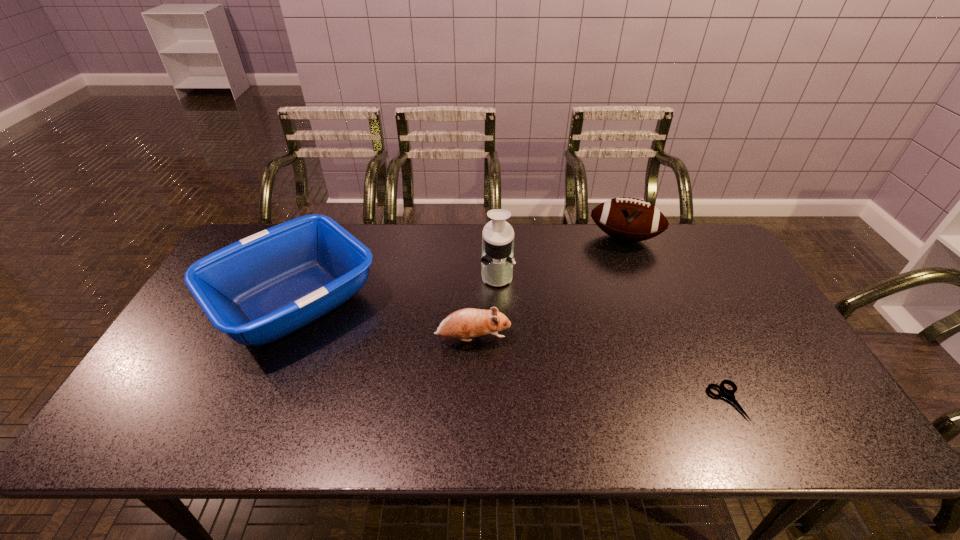
Where is `juicer`? juicer is located at coordinates (497, 260).

What are the coordinates of `football (American)` in the screenshot? It's located at (628, 219).

You are a GUI agent. You are given a task and a screenshot of the screen. Output one action in this format:
    pyautogui.click(x=<x>, y=<y>)
    Task: Click on the tray
    Image resolution: width=960 pixels, height=540 pixels.
    Given the screenshot: What is the action you would take?
    pyautogui.click(x=259, y=289)

Where is `hamster`? Image resolution: width=960 pixels, height=540 pixels. hamster is located at coordinates (466, 323).

The image size is (960, 540). I want to click on the shortest object, so click(729, 394).

Identify the location of shears. (729, 394).

Locate an element on the screen. Image resolution: width=960 pixels, height=540 pixels. free region located on the left of the juicer is located at coordinates (388, 274).

The width and height of the screenshot is (960, 540). I want to click on vacant space located 0.200m on the left of the football (American), so click(x=532, y=238).

You are a GUI agent. You are given a task and a screenshot of the screen. Output one action in this format:
    pyautogui.click(x=<x>, y=<y>)
    Task: Click on the free region located 0.130m on the back of the leftmost object
    The width and height of the screenshot is (960, 540).
    Given the screenshot: What is the action you would take?
    327,226

You are a GUI agent. You are given a task and a screenshot of the screen. Output one action in this format:
    pyautogui.click(x=<x>, y=<y>)
    Task: Click on the free space located at the face of the second shortest object
    This screenshot has height=540, width=960.
    Given the screenshot: What is the action you would take?
    pyautogui.click(x=559, y=339)